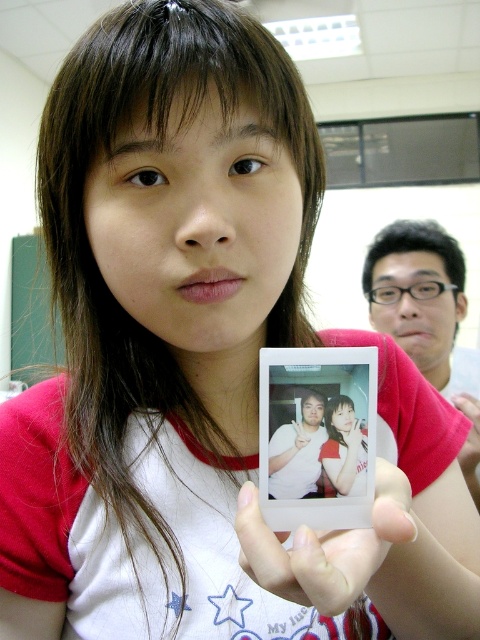
You are a photographer trying to arrange two white items in a display case. The items are the white matte polaroid at center and the matte white photo at center. The display case has a width of 2 inches. Can both items fit side by side without overlapping?

The white matte polaroid at center and matte white photo at center are 2.04 inches apart from each other. Since the display case is only 2 inches wide, the items would overlap by 0.04 inches and not fit side by side.

You are an art student who needs to frame two photos for an exhibition. You have a white matte polaroid at center and a matte white photo at center. Which one requires a larger frame due to its size?

The white matte polaroid at center requires a larger frame because it is larger in size than the matte white photo at center.

You are a photographer checking the composition of the scene. You notice the white glossy photo frame at center and the matte white photo at center. Which object takes up more space in the image?

The white glossy photo frame at center is larger in size than the matte white photo at center, so it takes up more space in the image.